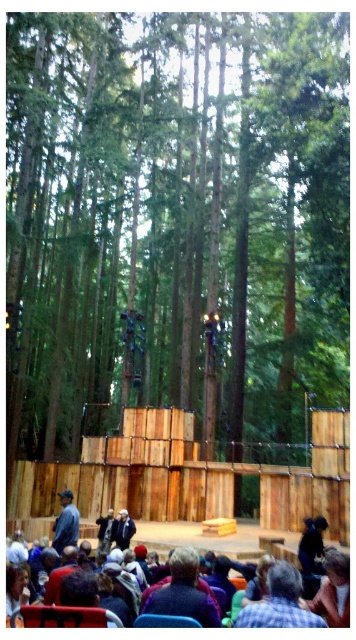
Between brown wood tree at center and dark blue shirt at lower left, which one is positioned lower?

Positioned lower is dark blue shirt at lower left.

Does brown wood tree at center appear over dark blue shirt at lower left?

Yes.

This screenshot has height=640, width=356. Find the location of `brown wood tree at center`. brown wood tree at center is located at coordinates (175, 220).

Is dark gray fabric crowd at lower center positioned behind dark blue shirt at lower left?

Yes.

You are a GUI agent. You are given a task and a screenshot of the screen. Output one action in this format:
    pyautogui.click(x=<x>, y=<y>)
    Task: Click on the dark gray fabric crowd at lower center
    The height and width of the screenshot is (640, 356).
    Given the screenshot: What is the action you would take?
    pyautogui.click(x=217, y=540)

Find the location of a particular element. dark gray fabric crowd at lower center is located at coordinates (217, 540).

Does point (244, 540) come in front of point (253, 621)?

That is False.

The height and width of the screenshot is (640, 356). Describe the element at coordinates (217, 540) in the screenshot. I see `dark gray fabric crowd at lower center` at that location.

Is point (284, 532) farther from camera compared to point (275, 564)?

Yes, it is behind point (275, 564).

What are the coordinates of `dark gray fabric crowd at lower center` in the screenshot? It's located at (217, 540).